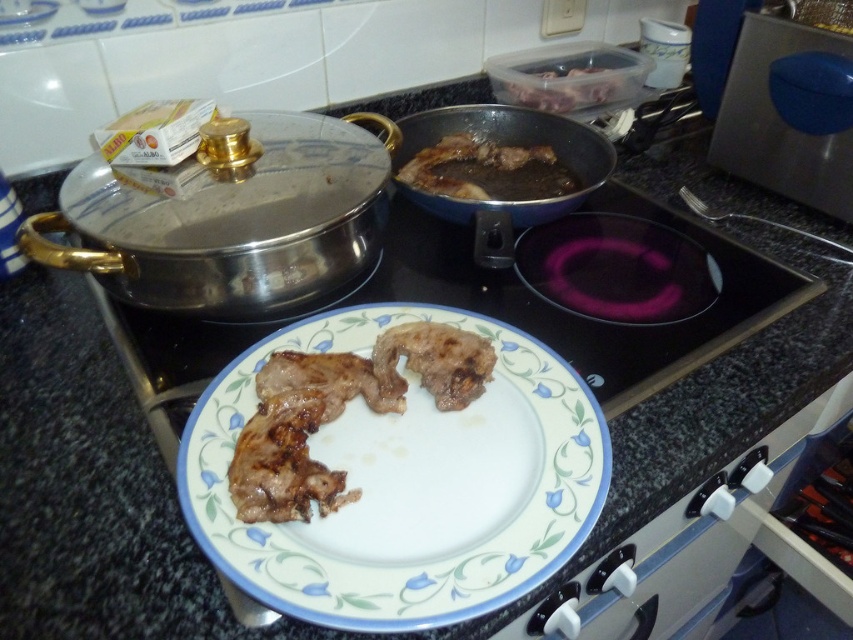
Can you confirm if translucent plastic container at upper right is bigger than satin silver fork at right?

Indeed, translucent plastic container at upper right has a larger size compared to satin silver fork at right.

Between point (529, 99) and point (728, 212), which one is positioned in front?

Point (728, 212)

Find the location of a particular element. translucent plastic container at upper right is located at coordinates (561, 88).

Who is more forward, [312,509] or [561,76]?

Point [312,509]

Is white ceramic plate at center thinner than translucent plastic container at upper right?

In fact, white ceramic plate at center might be wider than translucent plastic container at upper right.

Does point (418, 616) come in front of point (579, 104)?

Yes, it is in front of point (579, 104).

Locate an element on the screen. white ceramic plate at center is located at coordinates coord(408,483).

Is shiny metallic frying pan at upper left thinner than satin silver fork at right?

No, shiny metallic frying pan at upper left is not thinner than satin silver fork at right.

Can you confirm if shiny metallic frying pan at upper left is positioned to the left of satin silver fork at right?

Indeed, shiny metallic frying pan at upper left is positioned on the left side of satin silver fork at right.

The image size is (853, 640). What are the coordinates of `shiny metallic frying pan at upper left` in the screenshot? It's located at [x=231, y=216].